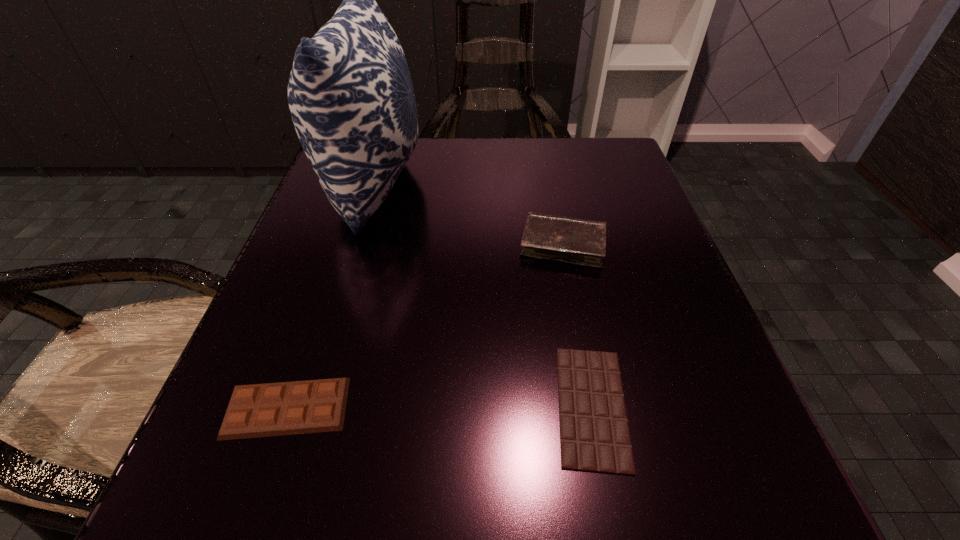
The width and height of the screenshot is (960, 540). What are the coordinates of `object at the far edge` in the screenshot? It's located at (351, 98).

Where is `object that is at the near edge`? The width and height of the screenshot is (960, 540). object that is at the near edge is located at coordinates (594, 433).

The image size is (960, 540). Identify the location of cushion situated at the left edge. (351, 98).

Where is `chocolate bar that is at the left edge`? This screenshot has height=540, width=960. chocolate bar that is at the left edge is located at coordinates (286, 408).

Locate an element on the screen. This screenshot has height=540, width=960. diary that is at the right edge is located at coordinates (582, 242).

Where is `chocolate bar at the right edge`? The width and height of the screenshot is (960, 540). chocolate bar at the right edge is located at coordinates (594, 433).

Where is `object at the far left corner`? object at the far left corner is located at coordinates (351, 98).

Where is `object that is at the near right corner`? object that is at the near right corner is located at coordinates (594, 433).

Where is `vacant space at the far edge`? Image resolution: width=960 pixels, height=540 pixels. vacant space at the far edge is located at coordinates (x=530, y=176).

You are a GUI agent. You are given a task and a screenshot of the screen. Output one action in this format:
    pyautogui.click(x=<x>, y=<y>)
    Task: Click on the vacant space at the near edge
    This screenshot has height=540, width=960.
    Given the screenshot: What is the action you would take?
    pyautogui.click(x=363, y=497)